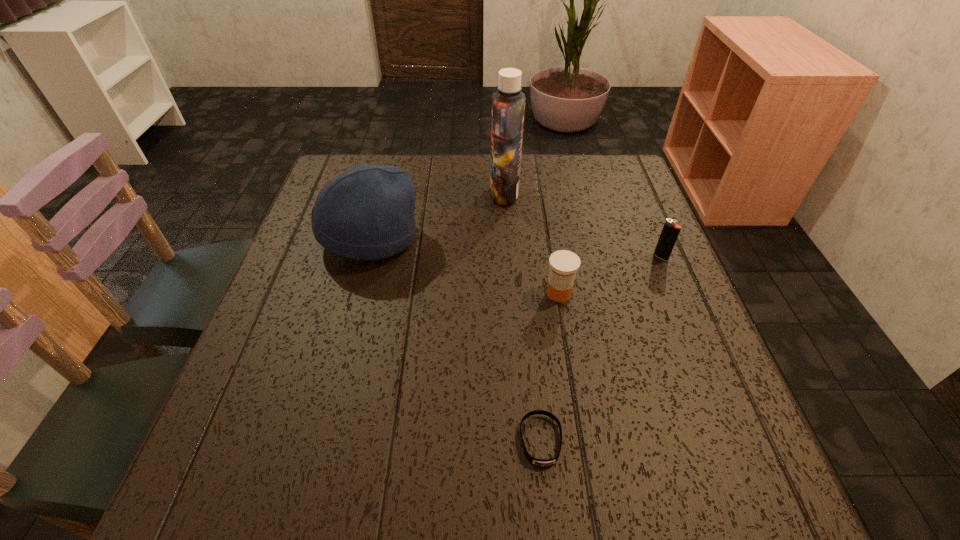
Where is `free space located 0.290m on the front label of the shampoo`? The height and width of the screenshot is (540, 960). free space located 0.290m on the front label of the shampoo is located at coordinates (385, 193).

I want to click on free space located 0.370m on the front of the leftmost object, so click(319, 429).

Image resolution: width=960 pixels, height=540 pixels. What are the coordinates of `free space located 0.070m on the left of the igniter` in the screenshot? It's located at (625, 257).

Find the location of `vacant space situated 0.240m on the label of the fourth farthest object`. vacant space situated 0.240m on the label of the fourth farthest object is located at coordinates 578,409.

The width and height of the screenshot is (960, 540). I want to click on object at the far edge, so click(x=508, y=103).

At what (x,y) coordinates should I click in order to perform the action: click on object present at the near edge. Please return your answer as a coordinate pair (x, y). This screenshot has height=540, width=960. Looking at the image, I should click on (539, 462).

Locate an element on the screen. This screenshot has height=540, width=960. object that is positioned at the left edge is located at coordinates (367, 212).

Where is `object located in the right edge section of the desktop`? This screenshot has height=540, width=960. object located in the right edge section of the desktop is located at coordinates (670, 231).

Locate an element on the screen. This screenshot has width=960, height=540. free space at the far edge of the desktop is located at coordinates (542, 170).

Image resolution: width=960 pixels, height=540 pixels. Identify the location of vacant space at the near edge of the desktop. (311, 459).